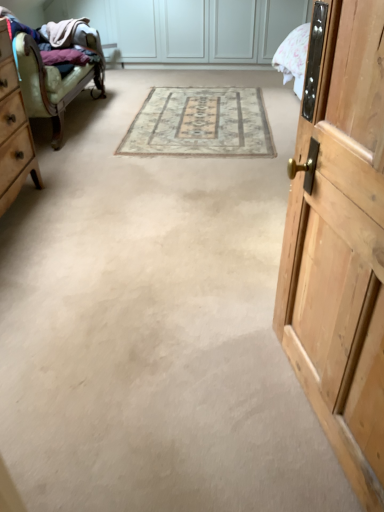
Question: Does wooden door at right contain beige carpet at center?

Choices:
 (A) no
 (B) yes

Answer: (A)

Question: Is wooden door at right oriented towards beige carpet at center?

Choices:
 (A) yes
 (B) no

Answer: (B)

Question: From the image's perspective, is wooden door at right above beige carpet at center?

Choices:
 (A) yes
 (B) no

Answer: (B)

Question: Is wooden door at right in front of beige carpet at center?

Choices:
 (A) no
 (B) yes

Answer: (B)

Question: Is wooden door at right bigger than beige carpet at center?

Choices:
 (A) no
 (B) yes

Answer: (B)

Question: Considering the relative positions of leather armchair at left and beige carpet at center in the image provided, is leather armchair at left to the left or to the right of beige carpet at center?

Choices:
 (A) right
 (B) left

Answer: (B)

Question: From the image's perspective, relative to beige carpet at center, is leather armchair at left above or below?

Choices:
 (A) below
 (B) above

Answer: (B)

Question: Is leather armchair at left inside or outside of beige carpet at center?

Choices:
 (A) outside
 (B) inside

Answer: (A)

Question: In terms of width, does leather armchair at left look wider or thinner when compared to beige carpet at center?

Choices:
 (A) wide
 (B) thin

Answer: (B)

Question: Is point (157, 131) closer or farther from the camera than point (332, 218)?

Choices:
 (A) farther
 (B) closer

Answer: (A)

Question: Is beige carpet at center in front of or behind wooden door at right in the image?

Choices:
 (A) front
 (B) behind

Answer: (B)

Question: From a real-world perspective, relative to wooden door at right, is beige carpet at center vertically above or below?

Choices:
 (A) above
 (B) below

Answer: (B)

Question: Looking at the image, does beige carpet at center seem bigger or smaller compared to wooden door at right?

Choices:
 (A) big
 (B) small

Answer: (B)

Question: Is leather armchair at left inside or outside of wooden dresser at left?

Choices:
 (A) inside
 (B) outside

Answer: (B)

Question: From a real-world perspective, relative to wooden dresser at left, is leather armchair at left vertically above or below?

Choices:
 (A) above
 (B) below

Answer: (B)